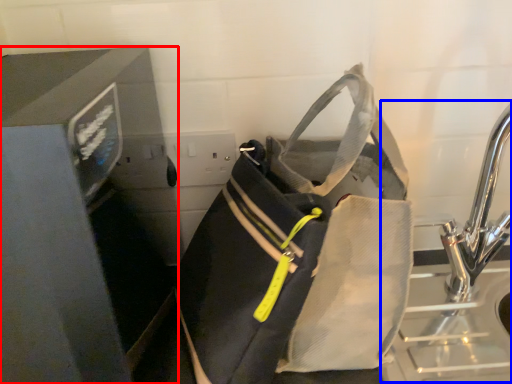
Question: Which object is closer to the camera taking this photo, appliance (highlighted by a red box) or sink (highlighted by a blue box)?

Choices:
 (A) appliance
 (B) sink

Answer: (A)